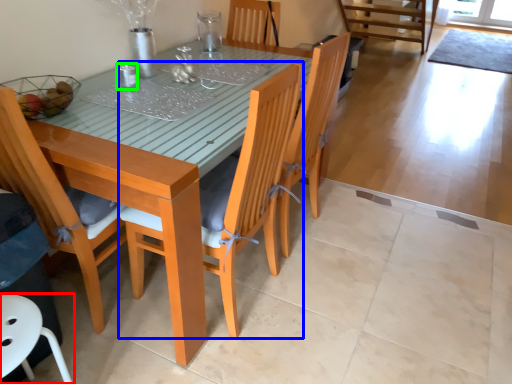
Question: Which object is the farthest from chair (highlighted by a red box)? Choose among these: chair (highlighted by a blue box) or tableware (highlighted by a green box).

Choices:
 (A) chair
 (B) tableware

Answer: (B)